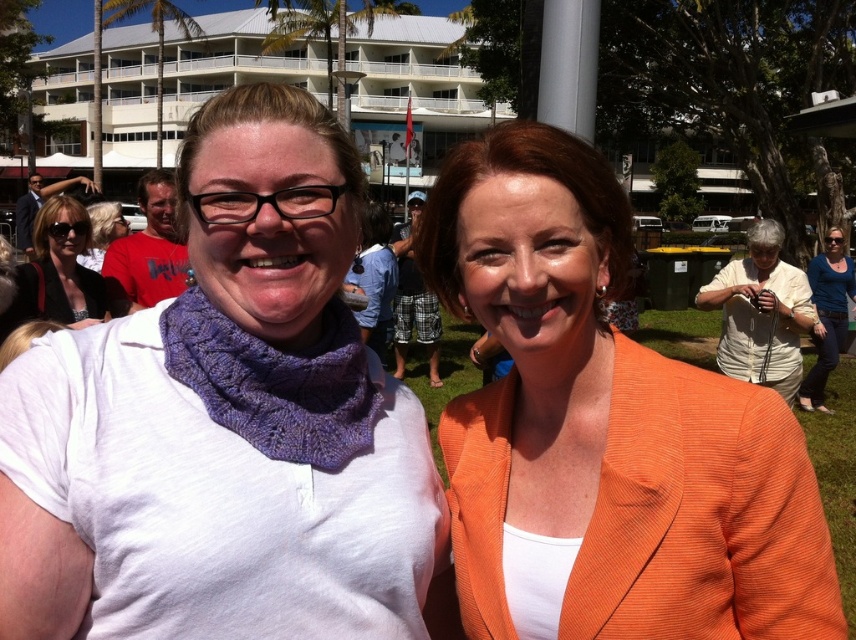
Who is higher up, purple knitted cowl at center or orange textured blazer at center?

purple knitted cowl at center

Is point (259, 401) positioned after point (819, 525)?

Yes, it is behind point (819, 525).

The width and height of the screenshot is (856, 640). I want to click on purple knitted cowl at center, so click(224, 422).

Is purple knitted scarf at left to the right of blonde hair at center from the viewer's perspective?

Indeed, purple knitted scarf at left is positioned on the right side of blonde hair at center.

Is purple knitted scarf at left taller than blonde hair at center?

Indeed, purple knitted scarf at left has a greater height compared to blonde hair at center.

Locate an element on the screen. The width and height of the screenshot is (856, 640). purple knitted scarf at left is located at coordinates (276, 381).

Measure the distance from orange textured blazer at center to knitted purple scarf at left.

3.71 meters

Is orange textured blazer at center smaller than knitted purple scarf at left?

No.

Identify the location of orange textured blazer at center. The height and width of the screenshot is (640, 856). (605, 426).